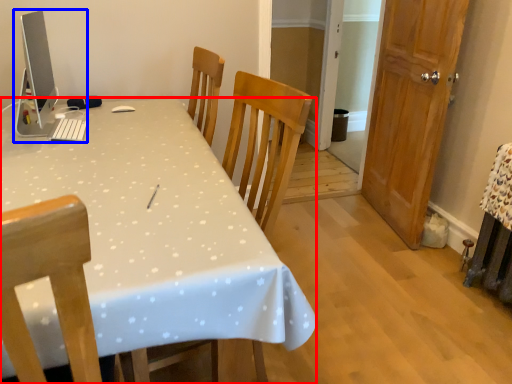
Question: Which of the following is the closest to the observer, desk (highlighted by a red box) or desktop computer (highlighted by a blue box)?

Choices:
 (A) desk
 (B) desktop computer

Answer: (A)